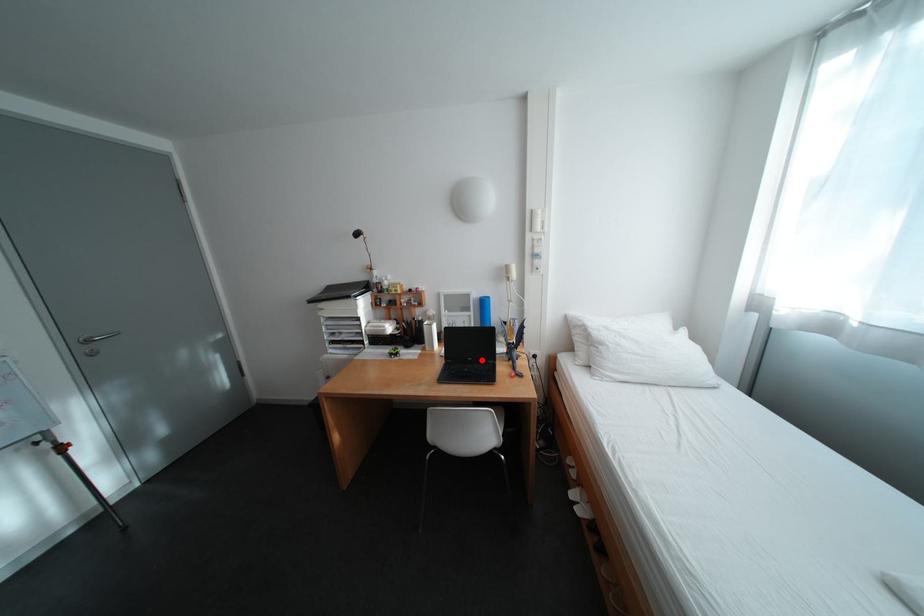
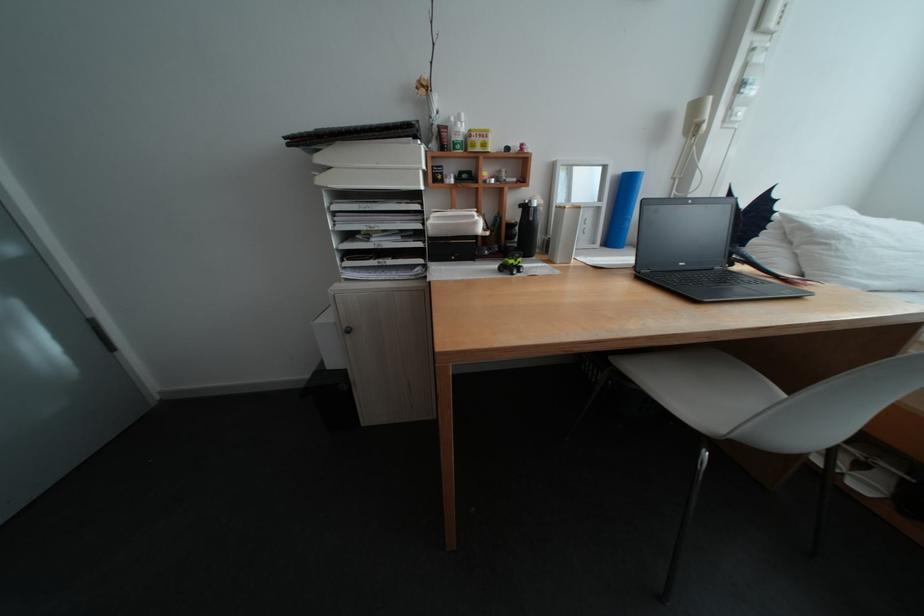
Find the pixel in the second image that matches the highlighted location in the first image.

(694, 265)